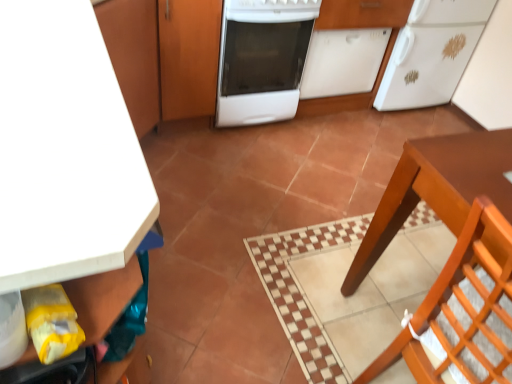
Find the location of a particular element. free space to the back side of brown wooden table at lower right is located at coordinates (374, 206).